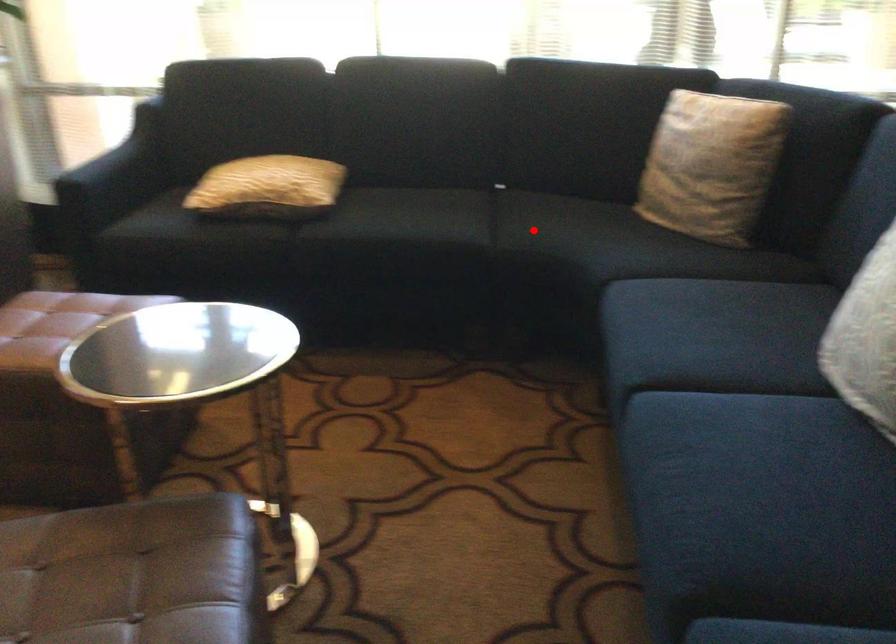
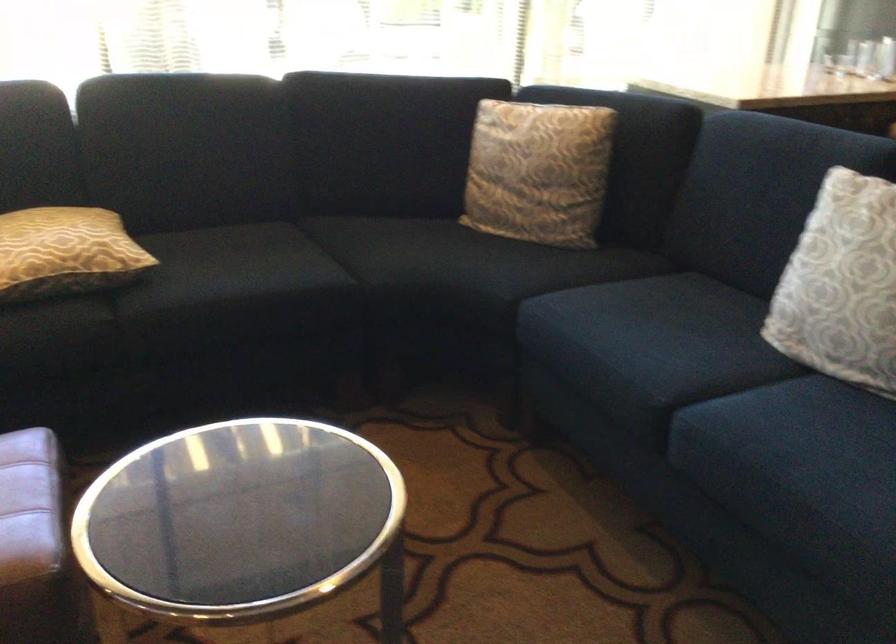
Find the pixel in the second image that matches the highlighted location in the first image.

(391, 261)